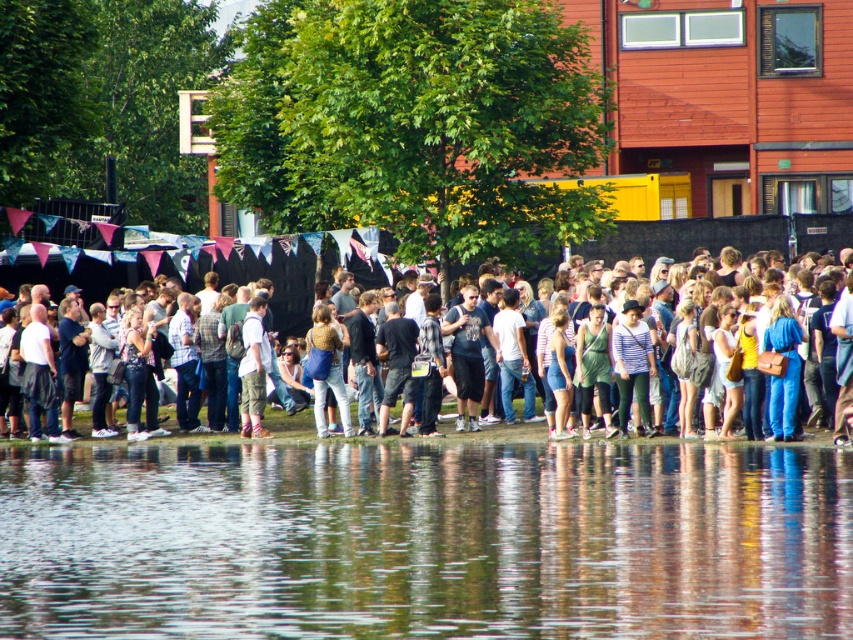
Question: Can you confirm if transparent water at lower center is smaller than light brown corduroy pants at center?

Choices:
 (A) yes
 (B) no

Answer: (B)

Question: Which object is farther from the camera taking this photo?

Choices:
 (A) denim shorts at center
 (B) light brown corduroy pants at center

Answer: (A)

Question: Does transparent water at lower center have a larger size compared to light brown corduroy pants at center?

Choices:
 (A) yes
 (B) no

Answer: (A)

Question: Which point is closer to the camera taking this photo?

Choices:
 (A) (242, 326)
 (B) (103, 284)

Answer: (A)

Question: Is transparent water at lower center in front of denim shorts at center?

Choices:
 (A) no
 (B) yes

Answer: (B)

Question: Which object is the farthest from the transparent water at lower center?

Choices:
 (A) denim shorts at center
 (B) light brown corduroy pants at center

Answer: (A)